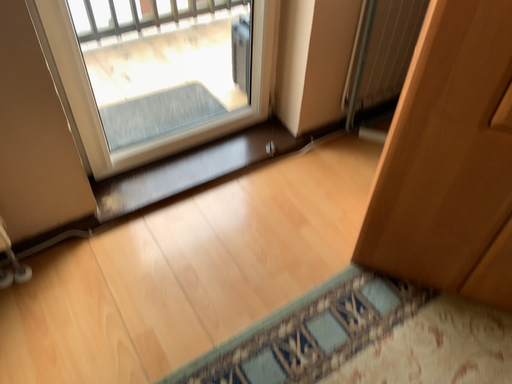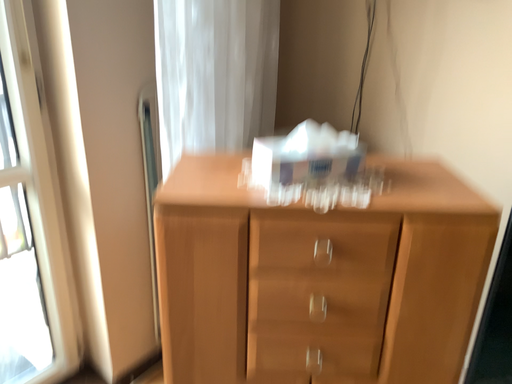
Question: How did the camera likely rotate when shooting the video?

Choices:
 (A) rotated downward
 (B) rotated upward

Answer: (B)